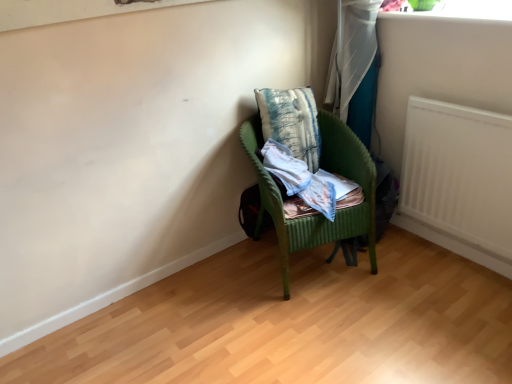
At what (x,y) coordinates should I click in order to perform the action: click on free space below green wicker chair at center (from a real-world perspective). Please return your answer as a coordinate pair (x, y). Looking at the image, I should click on (315, 261).